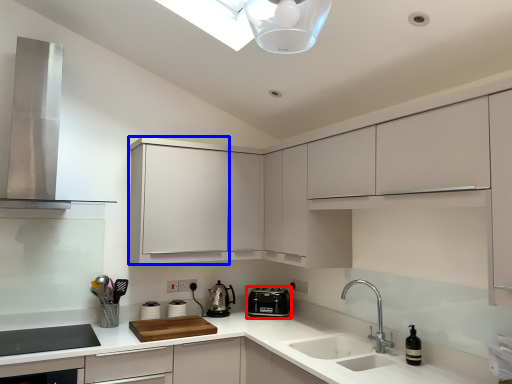
Question: Which point is further to the camera, kitchen appliance (highlighted by a red box) or cabinetry (highlighted by a blue box)?

Choices:
 (A) kitchen appliance
 (B) cabinetry

Answer: (A)